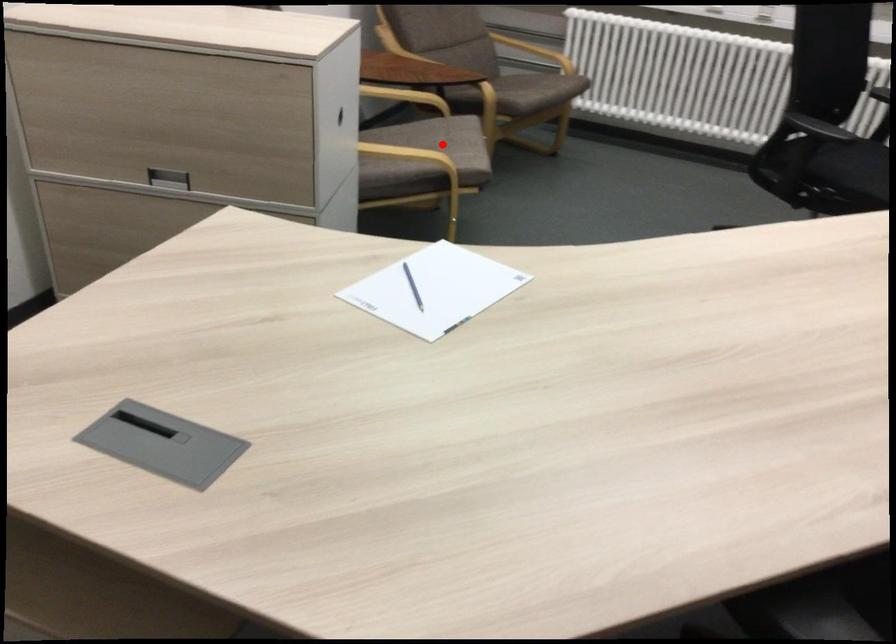
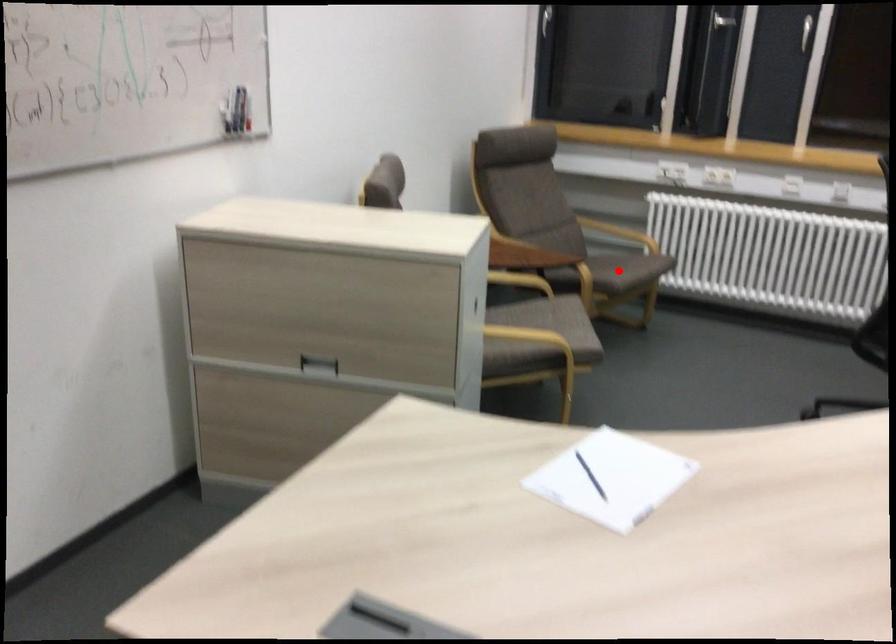
Looking at this image, I am providing you with two images of the same scene from different viewpoints. A red point is marked on the first image and another point is marked on the second image. Are the points marked in image1 and image2 representing the same 3D position?

No